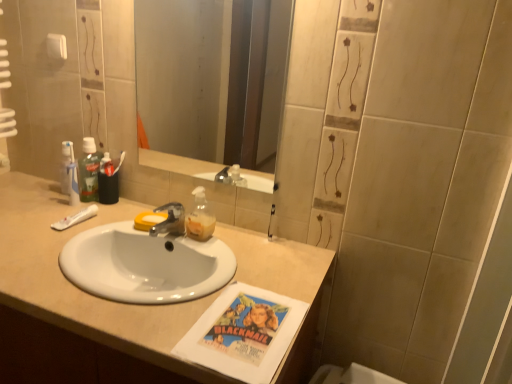
Question: From a real-world perspective, does white matte toothpaste at left stand above white glossy sink at center?

Choices:
 (A) yes
 (B) no

Answer: (A)

Question: Is white matte toothpaste at left shorter than white glossy sink at center?

Choices:
 (A) yes
 (B) no

Answer: (A)

Question: Considering the relative sizes of white matte toothpaste at left and white glossy sink at center in the image provided, is white matte toothpaste at left bigger than white glossy sink at center?

Choices:
 (A) yes
 (B) no

Answer: (B)

Question: Is white matte toothpaste at left oriented towards white glossy sink at center?

Choices:
 (A) no
 (B) yes

Answer: (A)

Question: Is white glossy sink at center inside white matte toothpaste at left?

Choices:
 (A) yes
 (B) no

Answer: (B)

Question: From a real-world perspective, is translucent plastic soap dispenser at center positioned above or below metallic silver faucet at center?

Choices:
 (A) above
 (B) below

Answer: (A)

Question: Considering the positions of translucent plastic soap dispenser at center and metallic silver faucet at center in the image, is translucent plastic soap dispenser at center wider or thinner than metallic silver faucet at center?

Choices:
 (A) wide
 (B) thin

Answer: (B)

Question: Based on their sizes in the image, would you say translucent plastic soap dispenser at center is bigger or smaller than metallic silver faucet at center?

Choices:
 (A) small
 (B) big

Answer: (B)

Question: Does point (189, 233) appear closer or farther from the camera than point (161, 231)?

Choices:
 (A) farther
 (B) closer

Answer: (B)

Question: From a real-world perspective, is smooth glass mirror at center positioned above or below translucent plastic soap dispenser at center?

Choices:
 (A) above
 (B) below

Answer: (A)

Question: Is point (247, 130) positioned closer to the camera than point (208, 231)?

Choices:
 (A) farther
 (B) closer

Answer: (A)

Question: From the image's perspective, is smooth glass mirror at center located above or below translucent plastic soap dispenser at center?

Choices:
 (A) above
 (B) below

Answer: (A)

Question: Which is correct: smooth glass mirror at center is inside translucent plastic soap dispenser at center, or outside of it?

Choices:
 (A) inside
 (B) outside

Answer: (B)

Question: Which is correct: white glossy sink at center is inside metallic silver faucet at center, or outside of it?

Choices:
 (A) inside
 (B) outside

Answer: (B)

Question: Considering the positions of point (141, 349) and point (156, 233), is point (141, 349) closer or farther from the camera than point (156, 233)?

Choices:
 (A) closer
 (B) farther

Answer: (A)